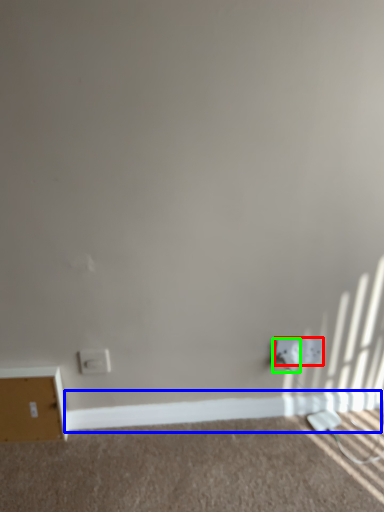
Question: Estimate the real-world distances between objects in this image. Which object is farther from power plugs and sockets (highlighted by a red box), molding (highlighted by a blue box) or electric outlet (highlighted by a green box)?

Choices:
 (A) molding
 (B) electric outlet

Answer: (A)